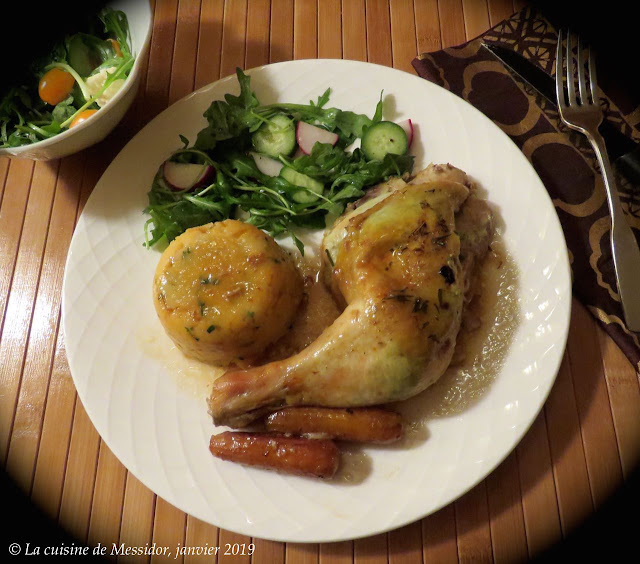
Identify the location of fork. (580, 122).